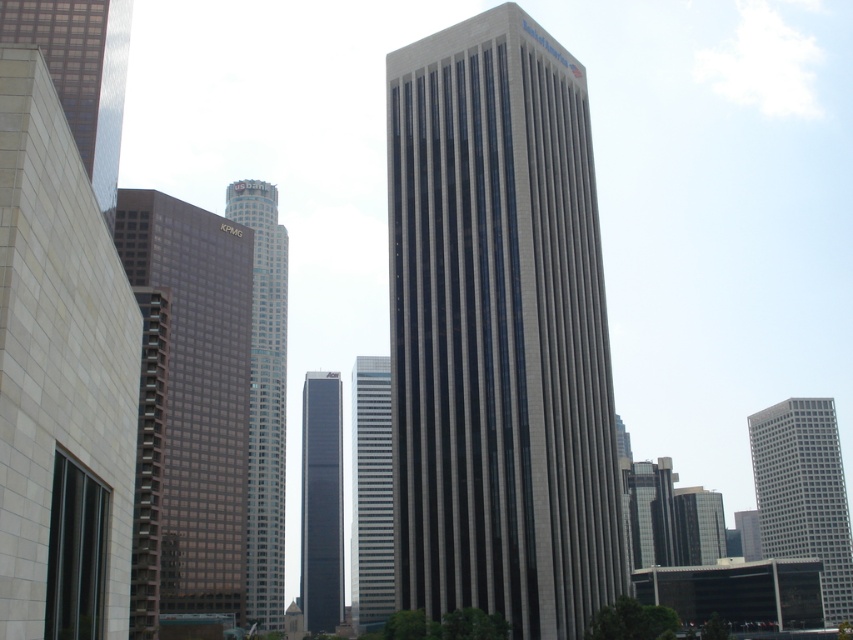
From the picture: You are an architect analyzing the city skyline. Which of the two buildings, the black glass tower at center or the glassy reflective skyscraper at right, has a narrower width?

The black glass tower at center is thinner than the glassy reflective skyscraper at right, so it has a narrower width.

You are a drone operator who needs to fly a drone between the brown glassy building at center and the reflective glass skyscraper at left. The drone has a wingspan of 3 meters. Can the drone safely pass through the space between them?

The distance between the brown glassy building at center and the reflective glass skyscraper at left is 31.90 meters, which is more than enough for the drone with a 3 meter wingspan to safely pass through.

You are a city planner assessing the potential for a new park between the black glass tower at center and the glassy reflective skyscraper at right. Given that the minimum required distance for such a park is 300 feet, can the proposed park be safely placed between them?

The distance between the black glass tower at center and the glassy reflective skyscraper at right is 335.42 feet, which exceeds the minimum requirement of 300 feet. Therefore, the proposed park can be safely placed between them.